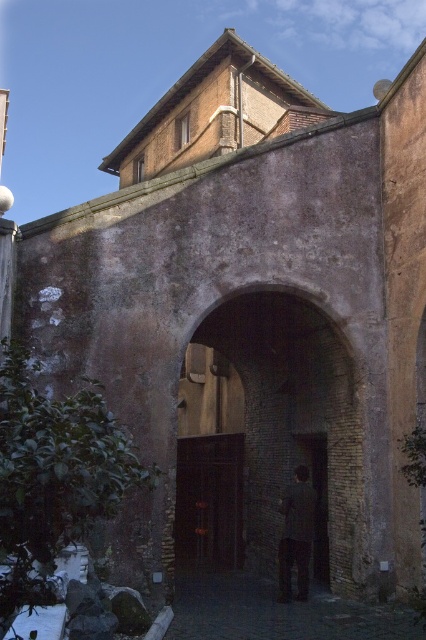
Question: Which object is closer to the camera taking this photo?

Choices:
 (A) dark gray suit at center
 (B) dark brick archway at center

Answer: (B)

Question: Which point is farther to the camera?

Choices:
 (A) (275, 467)
 (B) (232, 573)

Answer: (B)

Question: Where is dark brick archway at center located in relation to dark stone alley at center in the image?

Choices:
 (A) left
 (B) right

Answer: (A)

Question: Does dark stone alley at center have a lesser width compared to dark gray suit at center?

Choices:
 (A) no
 (B) yes

Answer: (A)

Question: Among these points, which one is nearest to the camera?

Choices:
 (A) (304, 536)
 (B) (241, 621)
 (C) (342, 410)

Answer: (B)

Question: Can you confirm if dark stone alley at center is positioned below dark gray suit at center?

Choices:
 (A) no
 (B) yes

Answer: (B)